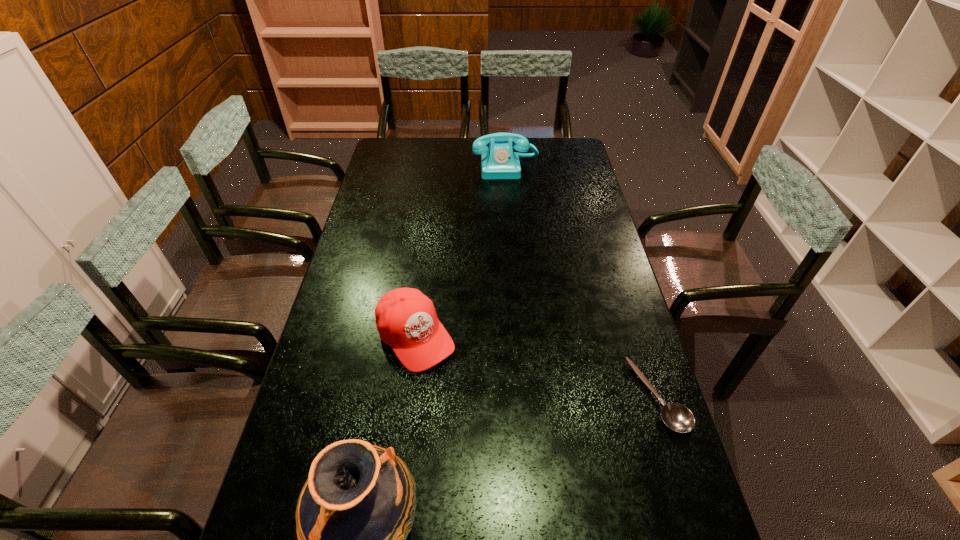
The height and width of the screenshot is (540, 960). I want to click on vacant spot on the desktop that is between the pottery and the rightmost object and is positioned on the dial of the third shortest object, so click(540, 449).

Identify the location of free space on the desktop that is between the nearest object and the ladle and is positioned on the front panel of the baseball cap. Image resolution: width=960 pixels, height=540 pixels. (517, 460).